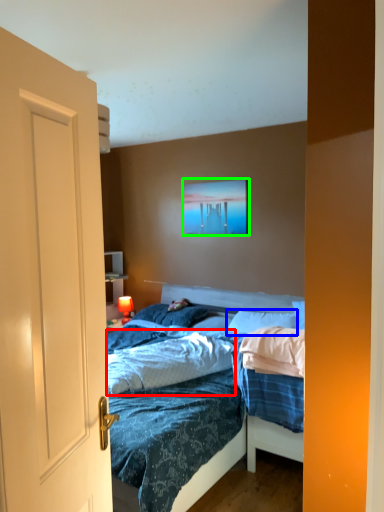
Question: Which is nearer to the sheet (highlighted by a red box)? pillow (highlighted by a blue box) or picture frame (highlighted by a green box).

Choices:
 (A) pillow
 (B) picture frame

Answer: (A)